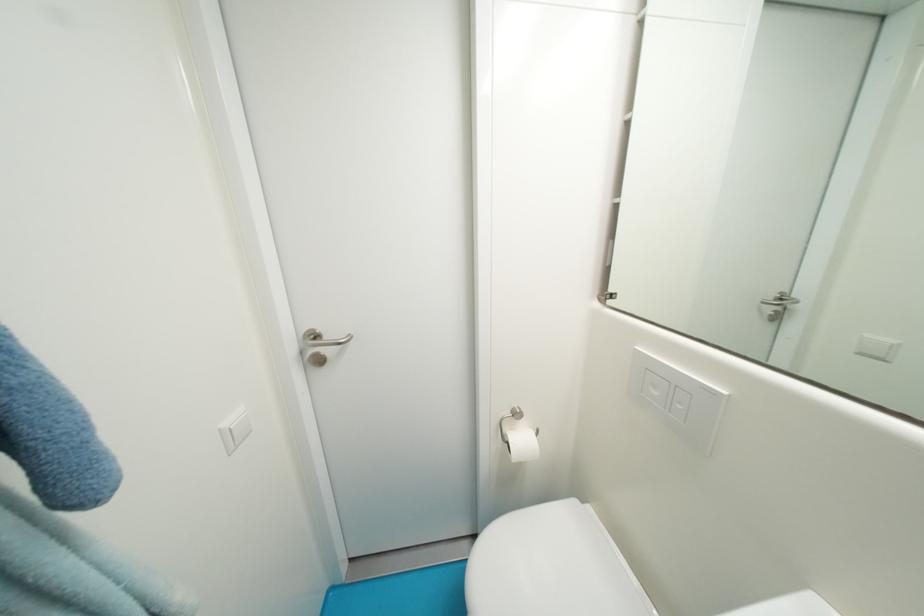
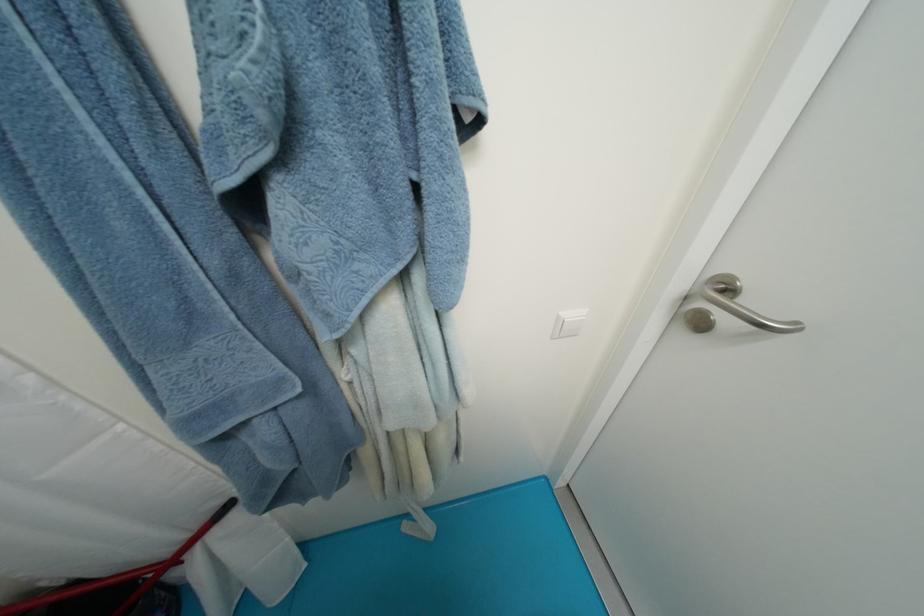
First-person continuous shooting, in which direction is the camera rotating?

The camera's rotation is toward left-down.